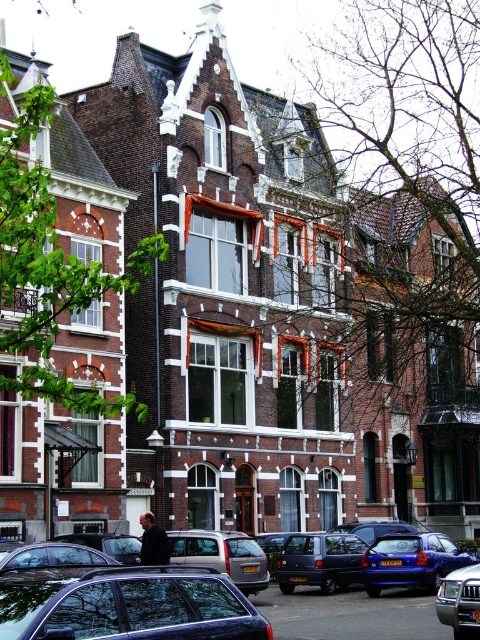
You are a delivery driver who needs to park your 2.5 meter long vehicle. You see the matte black car at lower left and the metallic blue hatchback at center. Which parking spot can accommodate your vehicle based on their lengths?

The metallic blue hatchback at center is longer than the matte black car at lower left. Since your vehicle is 2.5 meters long, you should choose the parking spot for the metallic blue hatchback at center as it can accommodate your vehicle.

You are a delivery person trying to park a new vehicle between the metallic blue hatchback at center and the silver metallic van at center. The new vehicle is 1.8 meters tall. Can it fit vertically between them without touching either?

The metallic blue hatchback at center is taller than the silver metallic van at center. Since the new vehicle is 1.8 meters tall, it can fit vertically between them as long as the space between the two vehicles is at least 1.8 meters in height. However, the exact height of the hatchback and van isn

You are standing at the point marked by the coordinates point (128,605) in the image. What object is exactly at that location?

The matte black car at lower left is located at point (128,605).